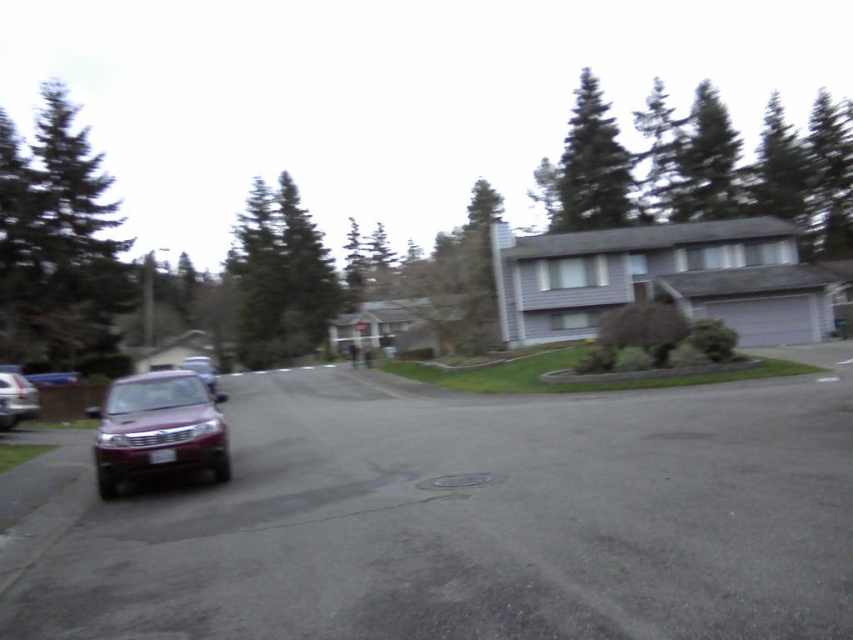
Which is below, green textured pine tree at upper center or satin burgundy suv at center-left?

Positioned lower is satin burgundy suv at center-left.

Does green textured pine tree at upper center have a smaller size compared to satin burgundy suv at center-left?

Incorrect, green textured pine tree at upper center is not smaller in size than satin burgundy suv at center-left.

Is point (627, 202) farther from viewer compared to point (202, 380)?

That is True.

Locate an element on the screen. The width and height of the screenshot is (853, 640). green textured pine tree at upper center is located at coordinates (587, 168).

Does green textured pine tree at upper center have a greater width compared to green textured pine tree at upper right?

Yes, green textured pine tree at upper center is wider than green textured pine tree at upper right.

Who is positioned more to the left, green textured pine tree at upper center or green textured pine tree at upper right?

green textured pine tree at upper right is more to the left.

Which is behind, point (585, 196) or point (712, 218)?

Positioned behind is point (712, 218).

Identify the location of green textured pine tree at upper center. (587, 168).

Between green textured pine tree at upper left and satin burgundy suv at center-left, which one has less height?

Standing shorter between the two is satin burgundy suv at center-left.

Is point (80, 368) farther from viewer compared to point (207, 356)?

No, it is in front of (207, 356).

Does point (90, 196) lie in front of point (200, 356)?

That is True.

Find the location of `green textured pine tree at upper left`. green textured pine tree at upper left is located at coordinates (59, 246).